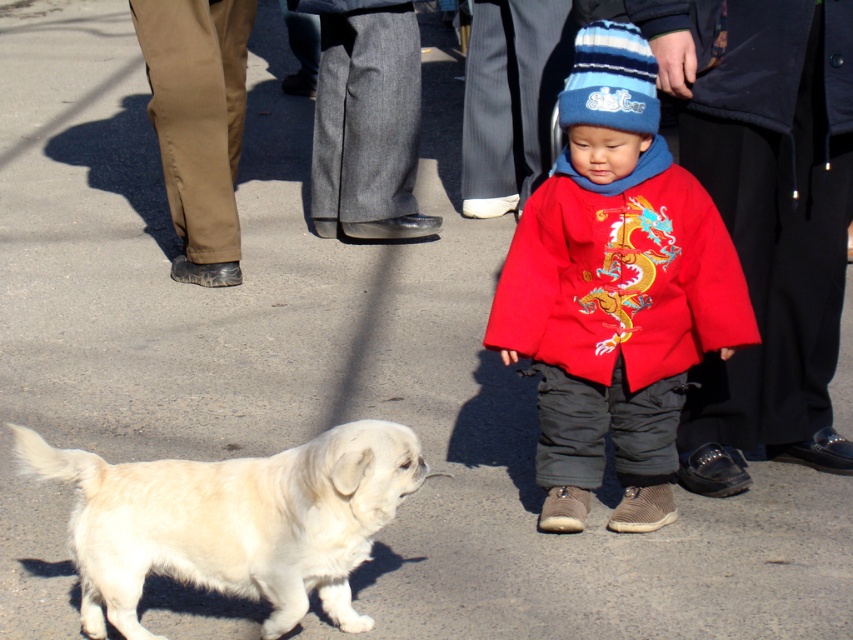
Is light beige fur at lower left closer to the viewer compared to blue knitted hat at center?

Yes, it is in front of blue knitted hat at center.

Which is above, light beige fur at lower left or blue knitted hat at center?

blue knitted hat at center is higher up.

This screenshot has width=853, height=640. I want to click on light beige fur at lower left, so click(x=231, y=522).

Does red matte coat at center have a greater width compared to blue knitted hat at center?

Correct, the width of red matte coat at center exceeds that of blue knitted hat at center.

Who is higher up, red matte coat at center or blue knitted hat at center?

→ blue knitted hat at center is above.

Which is behind, point (566, 308) or point (648, 122)?

Point (566, 308)

The width and height of the screenshot is (853, 640). In order to click on red matte coat at center in this screenshot , I will do `click(614, 291)`.

Can you confirm if red matte coat at center is positioned above light beige fur at lower left?

Yes, red matte coat at center is above light beige fur at lower left.

Is red matte coat at center smaller than light beige fur at lower left?

No, red matte coat at center is not smaller than light beige fur at lower left.

Which is in front, point (550, 296) or point (390, 500)?

Point (390, 500) is more forward.

Identify the location of red matte coat at center. This screenshot has width=853, height=640. (614, 291).